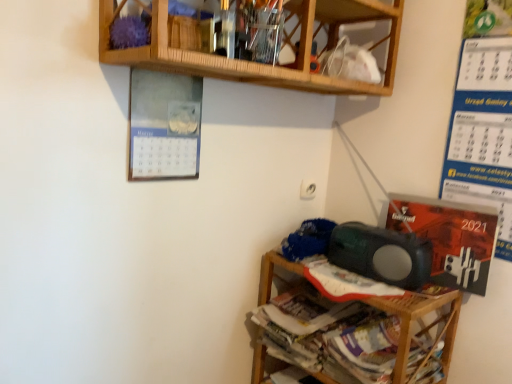
Question: From a real-world perspective, does matte green speaker at lower right sit lower than wooden shelf at lower right, which ranks as the 1th shelf in bottom-to-top order?

Choices:
 (A) no
 (B) yes

Answer: (A)

Question: Is matte green speaker at lower right closer to camera compared to wooden shelf at lower right, which ranks as the 1th shelf in bottom-to-top order?

Choices:
 (A) no
 (B) yes

Answer: (A)

Question: Can you confirm if matte green speaker at lower right is thinner than wooden shelf at lower right, the second shelf from the top?

Choices:
 (A) no
 (B) yes

Answer: (B)

Question: From a real-world perspective, is matte green speaker at lower right on wooden shelf at lower right, which ranks as the 1th shelf in bottom-to-top order?

Choices:
 (A) yes
 (B) no

Answer: (A)

Question: Considering the relative sizes of matte green speaker at lower right and wooden shelf at lower right, which ranks as the 1th shelf in bottom-to-top order, in the image provided, is matte green speaker at lower right wider than wooden shelf at lower right, which ranks as the 1th shelf in bottom-to-top order,?

Choices:
 (A) yes
 (B) no

Answer: (B)

Question: In terms of width, does matte green speaker at lower right look wider or thinner when compared to blue paper calendar at right, which appears as the second writing when ordered from the bottom?

Choices:
 (A) thin
 (B) wide

Answer: (B)

Question: In the image, is matte green speaker at lower right on the left side or the right side of blue paper calendar at right, which appears as the second writing when ordered from the bottom?

Choices:
 (A) right
 (B) left

Answer: (B)

Question: Considering the positions of matte green speaker at lower right and blue paper calendar at right, which appears as the second writing when ordered from the bottom, in the image, is matte green speaker at lower right taller or shorter than blue paper calendar at right, which appears as the second writing when ordered from the bottom,?

Choices:
 (A) tall
 (B) short

Answer: (B)

Question: In terms of size, does matte green speaker at lower right appear bigger or smaller than blue paper calendar at right, which appears as the second writing when ordered from the bottom?

Choices:
 (A) big
 (B) small

Answer: (A)

Question: Is wooden shelf at lower right, which ranks as the 1th shelf in bottom-to-top order, taller or shorter than wooden at upper center, arranged as the 1th shelf when viewed from the top?

Choices:
 (A) tall
 (B) short

Answer: (A)

Question: Choose the correct answer: Is wooden shelf at lower right, the second shelf from the top, inside wooden at upper center, arranged as the 1th shelf when viewed from the top, or outside it?

Choices:
 (A) outside
 (B) inside

Answer: (A)

Question: In the image, is wooden shelf at lower right, the second shelf from the top, on the left side or the right side of wooden at upper center, arranged as the 1th shelf when viewed from the top?

Choices:
 (A) left
 (B) right

Answer: (B)

Question: From the image's perspective, is wooden shelf at lower right, the second shelf from the top, located above or below wooden at upper center, arranged as the 1th shelf when viewed from the top?

Choices:
 (A) below
 (B) above

Answer: (A)

Question: From the image's perspective, is matte green speaker at lower right located above or below wooden shelf at lower right, the second shelf from the top?

Choices:
 (A) above
 (B) below

Answer: (A)

Question: Is point coord(337,238) closer or farther from the camera than point coord(263,264)?

Choices:
 (A) farther
 (B) closer

Answer: (B)